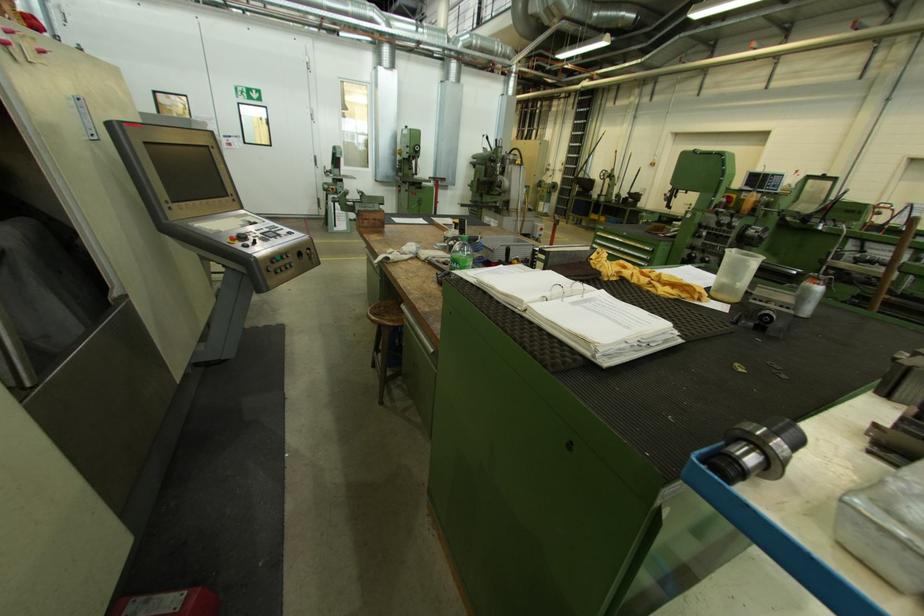
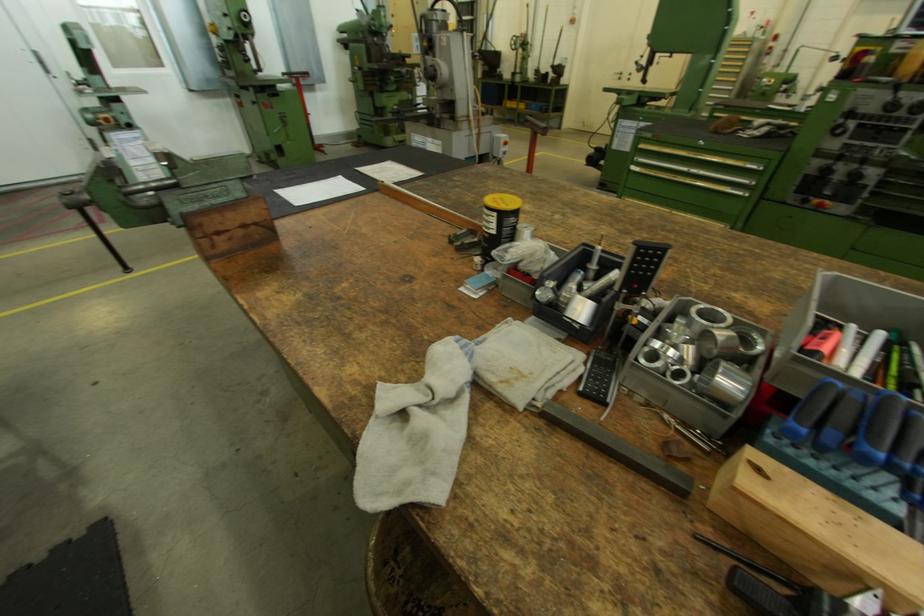
The point at (651, 259) is marked in the first image. Where is the corresponding point in the second image?

(752, 183)